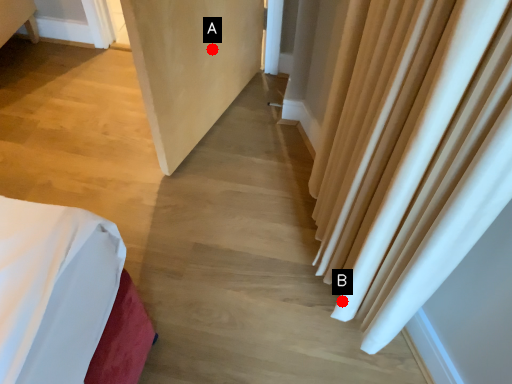
Question: Two points are circled on the image, labeled by A and B beside each circle. Which point is farther to the camera?

Choices:
 (A) A is further
 (B) B is further

Answer: (A)